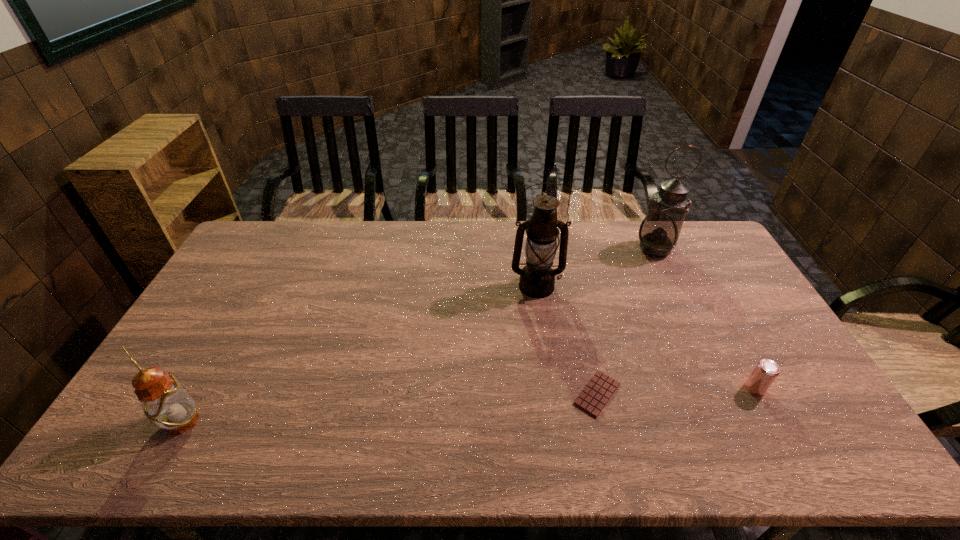
The width and height of the screenshot is (960, 540). Identify the location of unoccupied position between the second farthest object and the candy bar. pos(566,340).

Identify the location of object that is the second closest to the second shortest object. (659, 231).

Select which object appears as the second closest to the leftmost object. Please provide its 2D coordinates. Your answer should be formatted as a tuple, i.e. [(x, y)], where the tuple contains the x and y coordinates of a point satisfying the conditions above.

[(594, 397)]

Where is `oil lamp that is the closest one to the shortest oil lamp`? The height and width of the screenshot is (540, 960). oil lamp that is the closest one to the shortest oil lamp is located at coordinates (537, 279).

Select which oil lamp appears as the closest to the shortest oil lamp. Please provide its 2D coordinates. Your answer should be formatted as a tuple, i.e. [(x, y)], where the tuple contains the x and y coordinates of a point satisfying the conditions above.

[(537, 279)]

What are the coordinates of `vacant region that satisfies the following two spatial constraints: 1. on the back side of the farthest object; 2. on the left side of the candy bar` in the screenshot? It's located at (564, 249).

Identify the location of vacant position in the image that satisfies the following two spatial constraints: 1. on the back side of the candy bar; 2. on the right side of the leftmost oil lamp. The width and height of the screenshot is (960, 540). (197, 394).

Identify the location of vacant region that satisfies the following two spatial constraints: 1. on the back side of the second farthest oil lamp; 2. on the right side of the leftmost oil lamp. This screenshot has width=960, height=540. (256, 287).

Where is `vacant point that satisfies the following two spatial constraints: 1. on the back side of the farthest object; 2. on the left side of the candy bar`? This screenshot has height=540, width=960. vacant point that satisfies the following two spatial constraints: 1. on the back side of the farthest object; 2. on the left side of the candy bar is located at coordinates (564, 249).